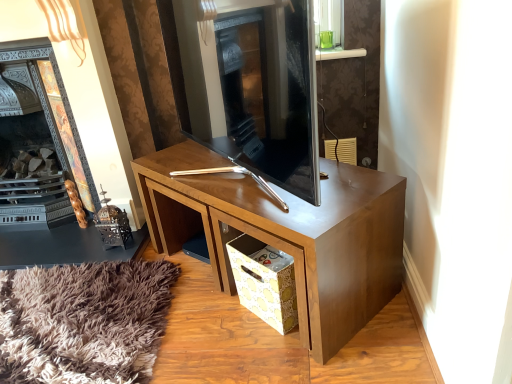
Question: Is yellow paper bag at lower center next to wooden desk at center?

Choices:
 (A) no
 (B) yes

Answer: (A)

Question: Is yellow paper bag at lower center facing away from wooden desk at center?

Choices:
 (A) no
 (B) yes

Answer: (B)

Question: Is yellow paper bag at lower center outside wooden desk at center?

Choices:
 (A) no
 (B) yes

Answer: (A)

Question: Is yellow paper bag at lower center aimed at wooden desk at center?

Choices:
 (A) no
 (B) yes

Answer: (B)

Question: Can you confirm if yellow paper bag at lower center is positioned to the left of wooden desk at center?

Choices:
 (A) no
 (B) yes

Answer: (A)

Question: Is yellow paper bag at lower center wider than wooden desk at center?

Choices:
 (A) no
 (B) yes

Answer: (A)

Question: Is dark gray stone fireplace at center, which ranks as the first fireplace in right-to-left order, beside wooden desk at center?

Choices:
 (A) no
 (B) yes

Answer: (A)

Question: Does dark gray stone fireplace at center, which ranks as the 2th fireplace in left-to-right order, have a larger size compared to wooden desk at center?

Choices:
 (A) no
 (B) yes

Answer: (A)

Question: Is dark gray stone fireplace at center, which ranks as the 2th fireplace in left-to-right order, not close to wooden desk at center?

Choices:
 (A) yes
 (B) no

Answer: (B)

Question: Considering the relative sizes of dark gray stone fireplace at center, which ranks as the 2th fireplace in left-to-right order, and wooden desk at center in the image provided, is dark gray stone fireplace at center, which ranks as the 2th fireplace in left-to-right order, thinner than wooden desk at center?

Choices:
 (A) yes
 (B) no

Answer: (A)

Question: Does dark gray stone fireplace at center, which ranks as the 2th fireplace in left-to-right order, turn towards wooden desk at center?

Choices:
 (A) yes
 (B) no

Answer: (B)

Question: Does dark gray stone fireplace at center, which ranks as the 2th fireplace in left-to-right order, lie in front of wooden desk at center?

Choices:
 (A) yes
 (B) no

Answer: (A)

Question: Can yellow paper bag at lower center be found inside dark wood fireplace at left, arranged as the 2th fireplace when viewed from the right?

Choices:
 (A) yes
 (B) no

Answer: (B)